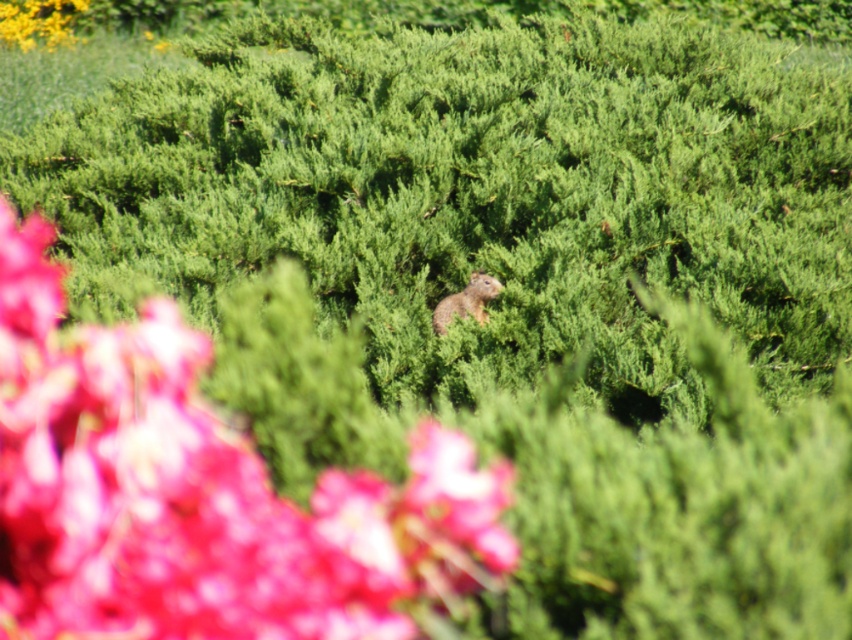
Who is more distant from viewer, (52, 36) or (471, 276)?

Positioned behind is point (52, 36).

Is yellow textured flower at upper left thinner than furry brown squirrel at center?

Incorrect, yellow textured flower at upper left's width is not less than furry brown squirrel at center's.

The image size is (852, 640). What are the coordinates of `yellow textured flower at upper left` in the screenshot? It's located at (38, 20).

The image size is (852, 640). Find the location of `yellow textured flower at upper left`. yellow textured flower at upper left is located at coordinates (38, 20).

Consider the image. Is matte pink petals at center below yellow textured flower at upper left?

Correct, matte pink petals at center is located below yellow textured flower at upper left.

The image size is (852, 640). I want to click on matte pink petals at center, so click(x=200, y=493).

Is point (243, 532) farther from camera compared to point (43, 22)?

That is False.

You are a GUI agent. You are given a task and a screenshot of the screen. Output one action in this format:
    pyautogui.click(x=<x>, y=<y>)
    Task: Click on the matte pink petals at center
    This screenshot has height=640, width=852.
    Given the screenshot: What is the action you would take?
    pyautogui.click(x=200, y=493)

Which is behind, point (45, 342) or point (481, 310)?

The point (481, 310) is more distant.

Can you confirm if matte pink petals at center is thinner than furry brown squirrel at center?

No, matte pink petals at center is not thinner than furry brown squirrel at center.

Who is more forward, [158,320] or [484,317]?

Point [158,320]

Find the location of `matte pink petals at center`. matte pink petals at center is located at coordinates (200, 493).